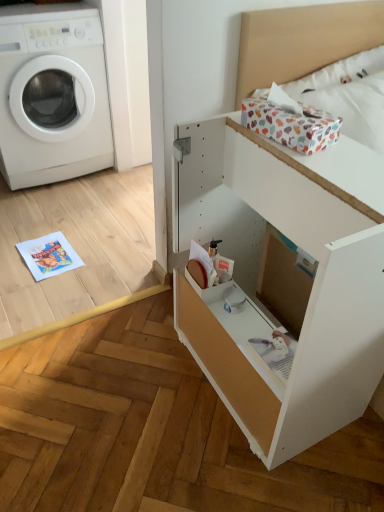
Where is `white plastic washing machine at left`? This screenshot has width=384, height=512. white plastic washing machine at left is located at coordinates (52, 94).

Could you tell me if white plastic washing machine at left is facing white cotton bedding at upper right?

No.

Which object is more forward, white plastic washing machine at left or white cotton bedding at upper right?

white cotton bedding at upper right is more forward.

Considering the positions of point (17, 121) and point (354, 135), is point (17, 121) closer or farther from the camera than point (354, 135)?

Point (17, 121).

From the picture: From the image's perspective, is white plastic washing machine at left located beneath white cotton bedding at upper right?

Incorrect, from the image's perspective, white plastic washing machine at left is higher than white cotton bedding at upper right.

What are the coordinates of `washing machine below the white cotton bedding at upper right (from a real-world perspective)` in the screenshot? It's located at (52, 94).

From the image's perspective, which one is positioned lower, white cotton bedding at upper right or white plastic washing machine at left?

white cotton bedding at upper right appears lower in the image.

Does white cotton bedding at upper right have a lesser height compared to white plastic washing machine at left?

Yes.

Is white cotton bedding at upper right outside of white plastic washing machine at left?

Yes.

Could you tell me if white cotton bedding at upper right is turned towards white matte file cabinet at center?

No.

Would you say white cotton bedding at upper right is a long distance from white matte file cabinet at center?

white cotton bedding at upper right is actually quite close to white matte file cabinet at center.

Is white cotton bedding at upper right at the left side of white matte file cabinet at center?

No, white cotton bedding at upper right is not to the left of white matte file cabinet at center.

How many degrees apart are the facing directions of white cotton bedding at upper right and white matte file cabinet at center?

The facing directions of white cotton bedding at upper right and white matte file cabinet at center are 85 degrees apart.

Which is behind, white plastic washing machine at left or white matte file cabinet at center?

white plastic washing machine at left is further away from the camera.

Is white matte file cabinet at center surrounded by white plastic washing machine at left?

No.

Is white plastic washing machine at left far away from white matte file cabinet at center?

→ Absolutely, white plastic washing machine at left is distant from white matte file cabinet at center.

Considering the relative positions of white matte file cabinet at center and white cotton bedding at upper right in the image provided, is white matte file cabinet at center in front of white cotton bedding at upper right?

Yes, white matte file cabinet at center is in front of white cotton bedding at upper right.

Considering the relative sizes of white matte file cabinet at center and white cotton bedding at upper right in the image provided, is white matte file cabinet at center smaller than white cotton bedding at upper right?

Incorrect, white matte file cabinet at center is not smaller in size than white cotton bedding at upper right.

In order to click on file cabinet below the white cotton bedding at upper right (from the image's perspective) in this screenshot , I will do `click(312, 285)`.

Is white matte file cabinet at center facing towards white plastic washing machine at left?

No.

Does white matte file cabinet at center have a smaller size compared to white plastic washing machine at left?

Indeed, white matte file cabinet at center has a smaller size compared to white plastic washing machine at left.

Is white matte file cabinet at center to the left of white plastic washing machine at left from the viewer's perspective?

Incorrect, white matte file cabinet at center is not on the left side of white plastic washing machine at left.

Is point (377, 253) closer or farther from the camera than point (9, 143)?

Point (377, 253).

Image resolution: width=384 pixels, height=512 pixels. In order to click on bedding lying below the white plastic washing machine at left (from the image's perspective) in this screenshot , I will do `click(335, 78)`.

Locate an element on the screen. washing machine below the white cotton bedding at upper right (from a real-world perspective) is located at coordinates (52, 94).

Based on their spatial positions, is white matte file cabinet at center or white cotton bedding at upper right further from white plastic washing machine at left?

Based on the image, white matte file cabinet at center appears to be further to white plastic washing machine at left.

Looking at the image, which one is located further to white plastic washing machine at left, white cotton bedding at upper right or white matte file cabinet at center?

white matte file cabinet at center is positioned further to the anchor white plastic washing machine at left.

Considering their positions, is white cotton bedding at upper right positioned closer to white matte file cabinet at center than white plastic washing machine at left?

The object closer to white matte file cabinet at center is white cotton bedding at upper right.

Which object lies further to the anchor point white matte file cabinet at center, white plastic washing machine at left or white cotton bedding at upper right?

white plastic washing machine at left is positioned further to the anchor white matte file cabinet at center.

Estimate the real-world distances between objects in this image. Which object is further from white cotton bedding at upper right, white plastic washing machine at left or white matte file cabinet at center?

Based on the image, white plastic washing machine at left appears to be further to white cotton bedding at upper right.

Considering their positions, is white matte file cabinet at center positioned closer to white cotton bedding at upper right than white plastic washing machine at left?

white matte file cabinet at center.

I want to click on file cabinet situated between white plastic washing machine at left and white cotton bedding at upper right from left to right, so click(x=312, y=285).